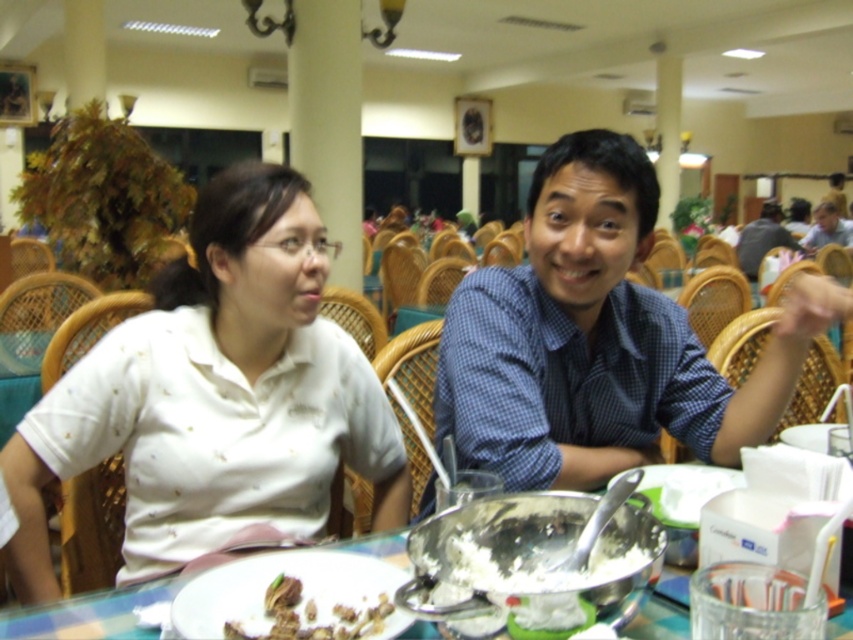
You are a photographer setting up a shoot in this dining area. You need to position a backdrop behind the two people wearing the blue checkered shirt at center and the matte blue shirt at center. Since the backdrop is 1.8 meters tall, will it cover both of them completely?

The blue checkered shirt at center has a greater height compared to matte blue shirt at center. Assuming the backdrop is 1.8 meters tall, if the taller individual wearing the blue checkered shirt at center is under 1.8 meters in height, the backdrop will cover both completely. However, if the taller person exceeds this height, part of their head may be visible above the backdrop.

You are a photographer standing in the dining area and want to take a photo of both the point at (209, 467) and the point at (166, 592). Which point should you focus on first to ensure both are in the frame?

You should focus on point (166, 592) first because it is in front of point (209, 467), so by framing the front point first, you can adjust the camera to include both points in the photo.